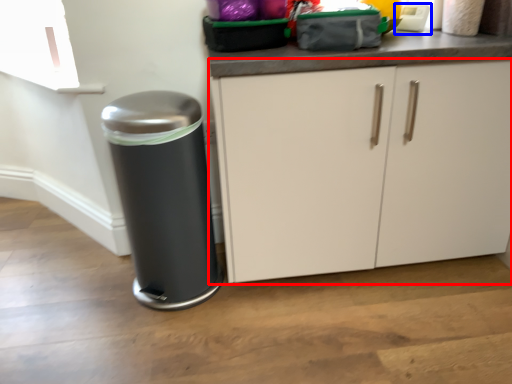
Question: Which of the following is the farthest to the observer, cabinetry (highlighted by a red box) or appliance (highlighted by a blue box)?

Choices:
 (A) cabinetry
 (B) appliance

Answer: (B)